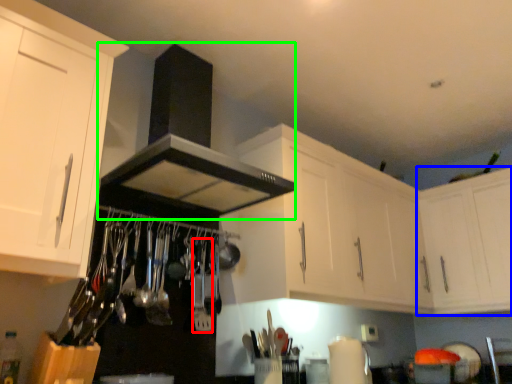
Question: Estimate the real-world distances between objects in this image. Which object is farther from silverware (highlighted by a red box), cabinetry (highlighted by a blue box) or exhaust hood (highlighted by a green box)?

Choices:
 (A) cabinetry
 (B) exhaust hood

Answer: (A)